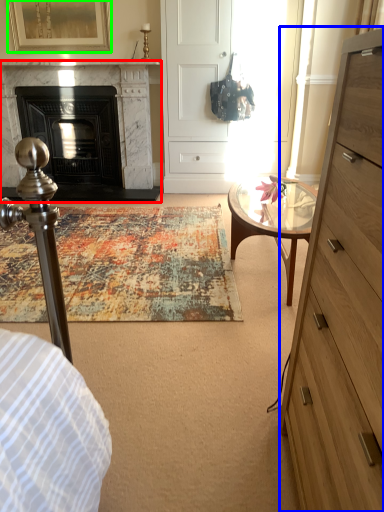
Question: Which object is positioned closest to fireplace (highlighted by a red box)? Select from chest of drawers (highlighted by a blue box) and picture frame (highlighted by a green box).

Choices:
 (A) chest of drawers
 (B) picture frame

Answer: (B)